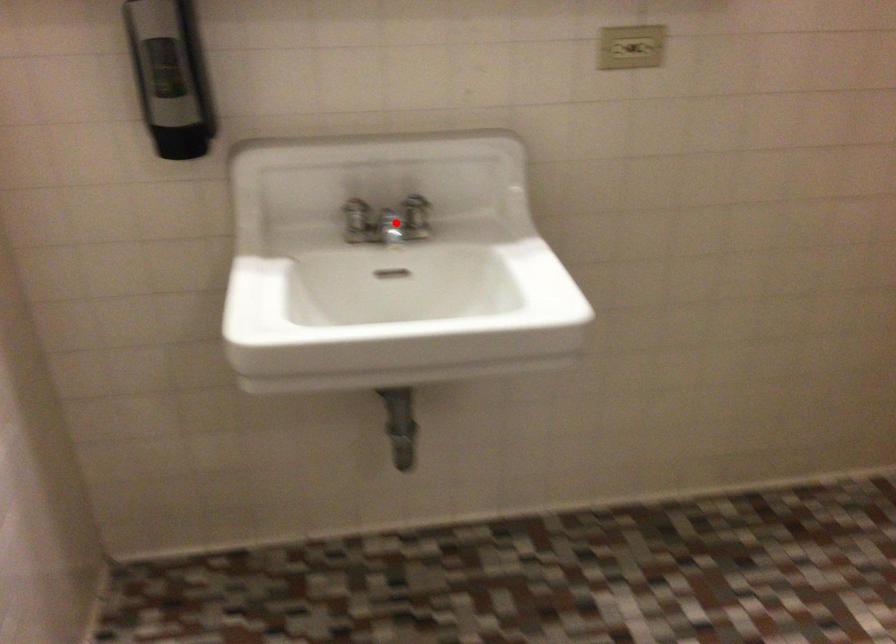
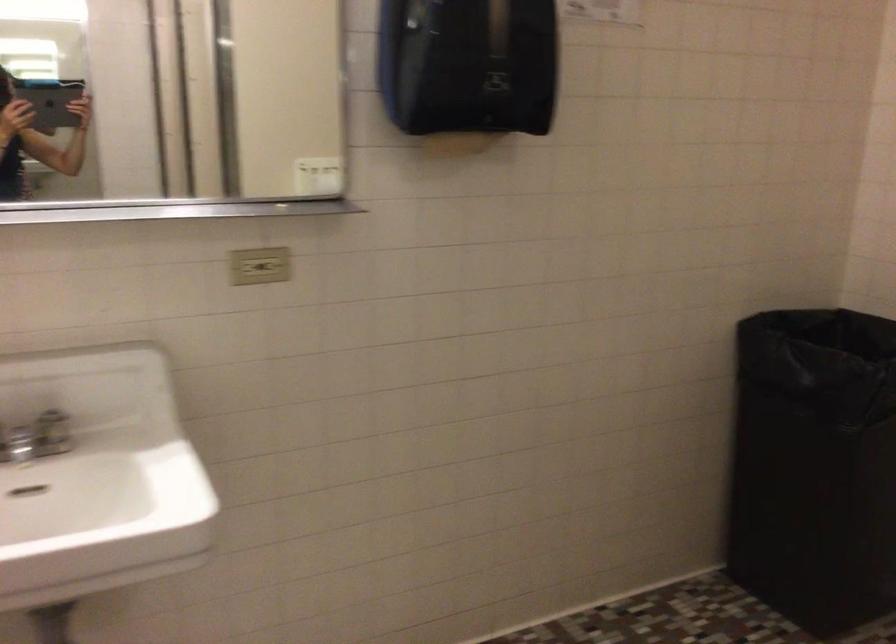
Question: I am providing you with two images of the same scene from different viewpoints. Image1 has a red point marked. In image2, the corresponding 3D location appears at what relative position? Reply with the corresponding letter.

Choices:
 (A) Closer
 (B) Farther

Answer: (B)